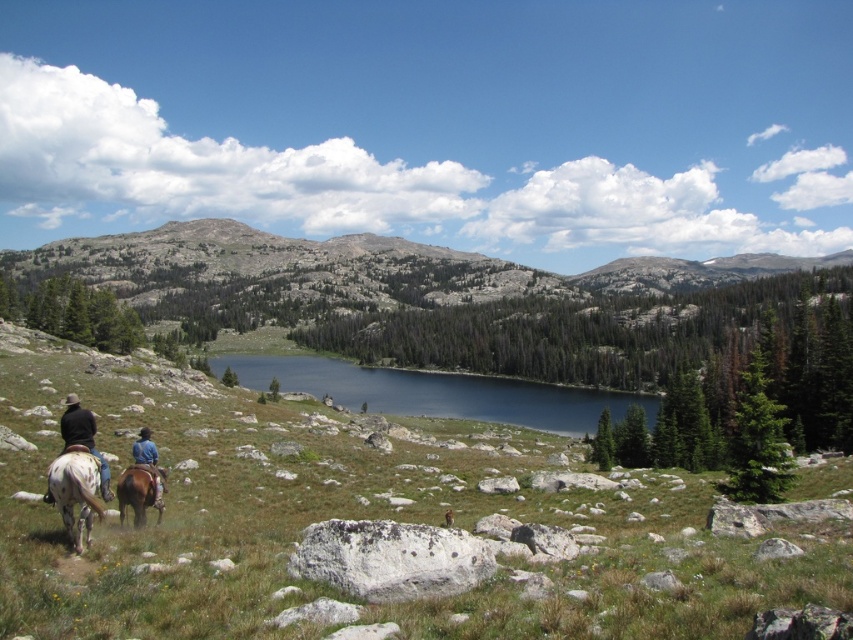
You are standing at the point marked by the coordinates point (361, 522) in the image. What do you see around you?

You are standing in the green grassy field at lower center marked by point (361, 522).

You are a photographer trying to capture a photo of the dappled white horse at lower left and blue denim jeans at lower left. Which object should you focus on first if you want to ensure both are in focus?

The dappled white horse at lower left is above the blue denim jeans at lower left, so you should focus on the dappled white horse at lower left first to ensure both are in focus.